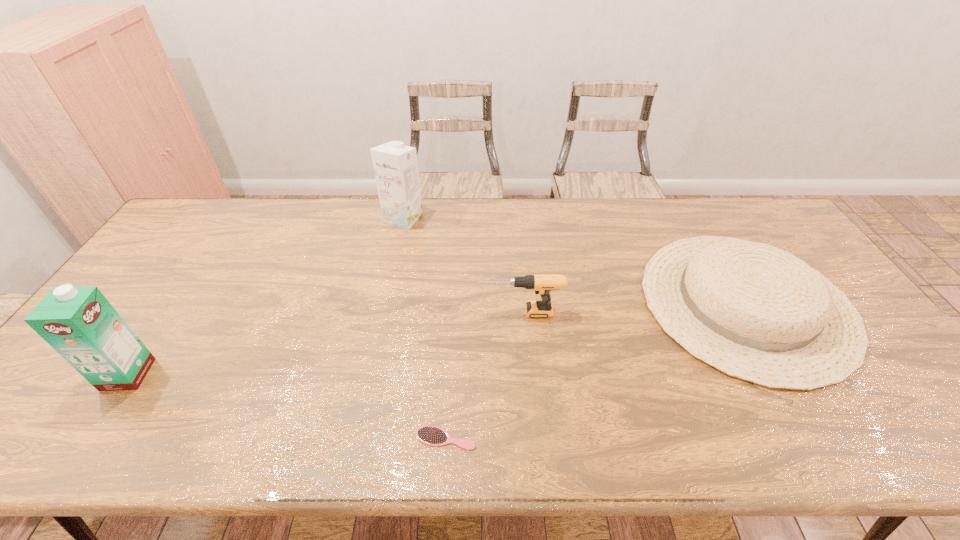
Locate an element on the screen. The width and height of the screenshot is (960, 540). object present at the left edge is located at coordinates 79,323.

Where is `object at the right edge`? The height and width of the screenshot is (540, 960). object at the right edge is located at coordinates (755, 312).

This screenshot has height=540, width=960. Identify the location of object that is at the far right corner. (755, 312).

Identify the location of free space at the far edge of the desktop. (648, 215).

Image resolution: width=960 pixels, height=540 pixels. In the image, there is a desktop. What are the coordinates of `vacant space at the near edge` in the screenshot? It's located at (219, 446).

The width and height of the screenshot is (960, 540). I want to click on vacant space at the left edge of the desktop, so click(164, 249).

Where is `blank space at the far left corner`? blank space at the far left corner is located at coordinates (221, 226).

This screenshot has height=540, width=960. In the image, there is a desktop. In order to click on vacant space at the near left corner in this screenshot , I will do `click(35, 424)`.

Where is `vacant space at the near right corner of the desktop`? vacant space at the near right corner of the desktop is located at coordinates (901, 423).

Where is `vacant region between the left carton and the second object from right to left`? vacant region between the left carton and the second object from right to left is located at coordinates (324, 343).